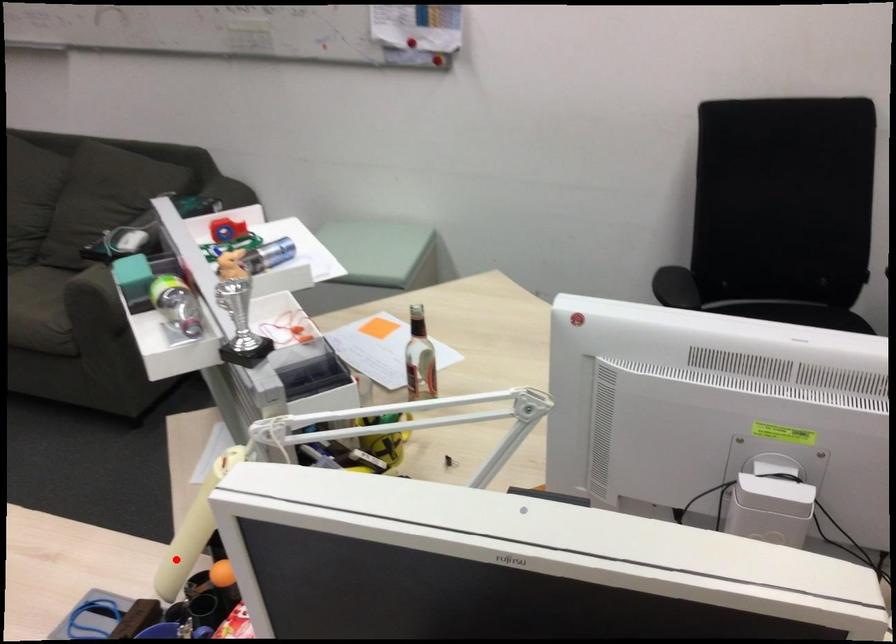
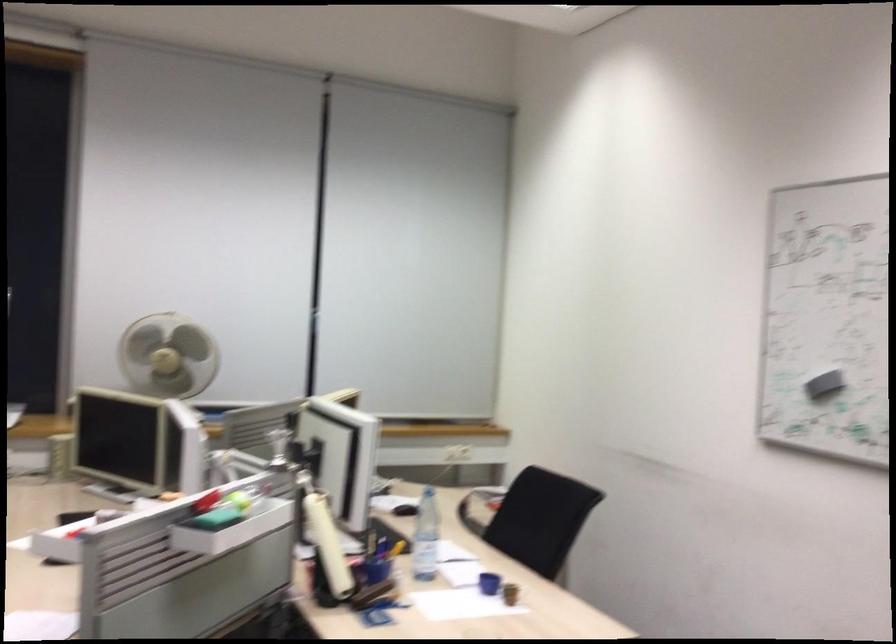
Question: I am providing you with two images of the same scene from different viewpoints. Image1 has a red point marked. In image2, the corresponding 3D location appears at what relative position? Reply with the corresponding letter.

Choices:
 (A) Closer
 (B) Farther

Answer: (B)